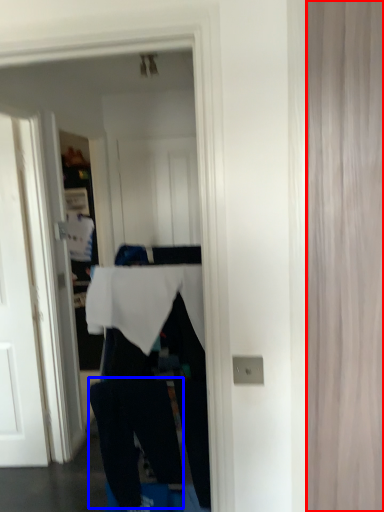
Question: Which object appears closest to the camera in this image, curtain (highlighted by a red box) or trousers (highlighted by a blue box)?

Choices:
 (A) curtain
 (B) trousers

Answer: (A)